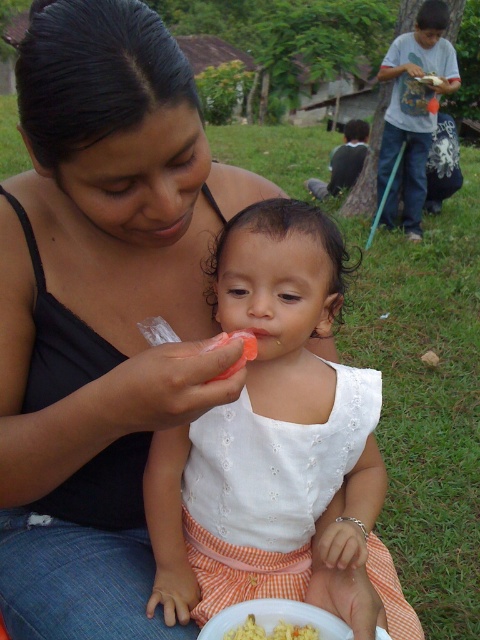
Question: Can you confirm if yellow matte scrambled eggs at lower center is bigger than orange translucent food at center?

Choices:
 (A) no
 (B) yes

Answer: (A)

Question: Is orange checkered skirt at center closer to camera compared to orange translucent food at center?

Choices:
 (A) no
 (B) yes

Answer: (A)

Question: Which object appears closest to the camera in this image?

Choices:
 (A) orange translucent food at center
 (B) white cotton shirt at center

Answer: (A)

Question: Estimate the real-world distances between objects in this image. Which object is closer to the white cotton shirt at upper right?

Choices:
 (A) yellow matte scrambled eggs at lower center
 (B) white cotton shirt at center

Answer: (B)

Question: Estimate the real-world distances between objects in this image. Which object is farther from the white cotton shirt at center?

Choices:
 (A) orange checkered skirt at center
 (B) orange translucent food at center
 (C) white cotton shirt at upper right
 (D) yellow matte scrambled eggs at lower center

Answer: (A)

Question: Is orange checkered skirt at center smaller than yellow matte scrambled eggs at lower center?

Choices:
 (A) yes
 (B) no

Answer: (B)